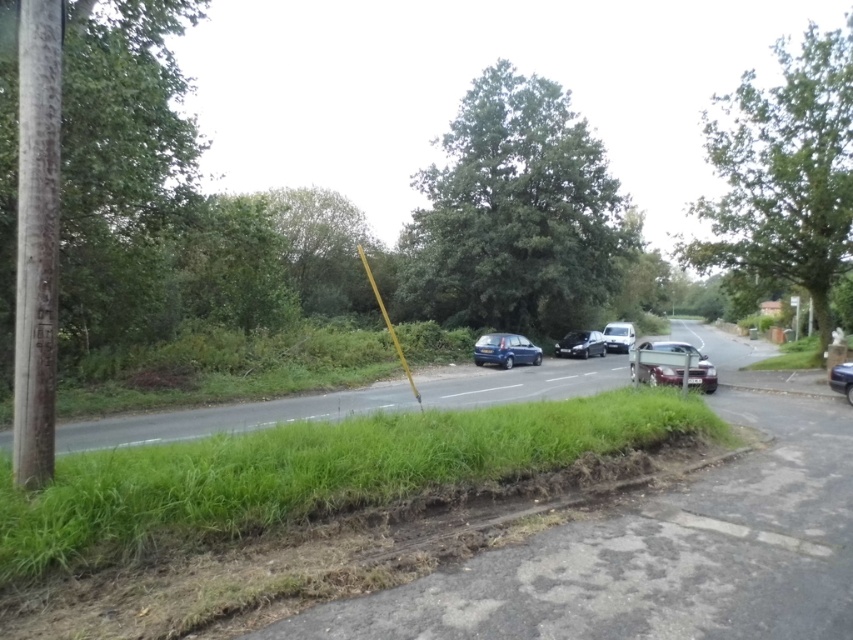
You are a delivery driver who needs to park your truck between the shiny metallic car at center and the shiny silver car at center. Your truck is 2.5 meters wide. Can you fit your truck in the space between them?

The shiny metallic car at center is wider than the shiny silver car at center. However, the exact width of the space between them isn t provided in the description. Without knowing the distance between the cars, it s impossible to determine if the truck will fit.

You are a driver trying to park your car behind the shiny metallic car at center and the shiny silver car at center. Which car should you park behind to have enough space for your car that is 1.5 meters tall?

The shiny silver car at center is taller than the shiny metallic car at center, so parking behind the shiny metallic car at center would leave more vertical space for your car that is 1.5 meters tall.

You are standing at the point with coordinates point (689, 364) in the image. What object are you standing on?

The point (689, 364) corresponds to the shiny metallic car at center, so you are standing on the shiny metallic car at center.